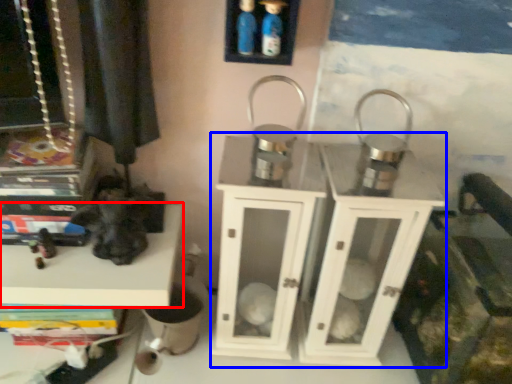
Question: Among these objects, which one is nearest to the camera, shelf (highlighted by a red box) or dresser (highlighted by a blue box)?

Choices:
 (A) shelf
 (B) dresser

Answer: (B)